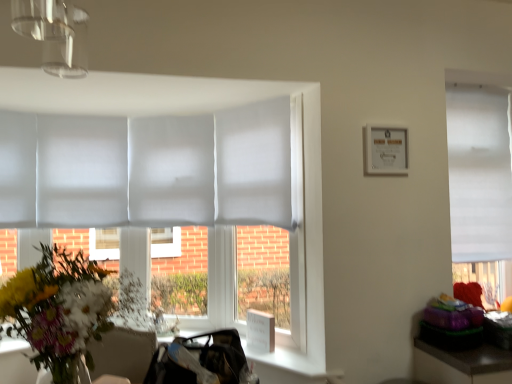
Image resolution: width=512 pixels, height=384 pixels. Describe the element at coordinates (58, 307) in the screenshot. I see `vibrant floral bouquet at left` at that location.

Where is `white matte window at right`? white matte window at right is located at coordinates (480, 180).

Find the location of a particular element. vibrant floral bouquet at left is located at coordinates (58, 307).

Can you confirm if vibrant floral bouquet at left is smaller than white paper picture frame at upper right?

Incorrect, vibrant floral bouquet at left is not smaller in size than white paper picture frame at upper right.

Which object is positioned more to the left, vibrant floral bouquet at left or white paper picture frame at upper right?

vibrant floral bouquet at left is more to the left.

Is vibrant floral bouquet at left far from white paper picture frame at upper right?

Yes, vibrant floral bouquet at left and white paper picture frame at upper right are quite far apart.

Is white paper picture frame at upper right located within vibrant floral bouquet at left?

No, white paper picture frame at upper right is not a part of vibrant floral bouquet at left.

Which of these two, white paper picture frame at upper right or white matte window at right, is bigger?

Bigger between the two is white matte window at right.

From a real-world perspective, is white paper picture frame at upper right above or below white matte window at right?

From a real-world perspective, white paper picture frame at upper right is physically above white matte window at right.

Is white paper picture frame at upper right positioned beyond the bounds of white matte window at right?

That's correct, white paper picture frame at upper right is outside of white matte window at right.

The height and width of the screenshot is (384, 512). In order to click on window that appears below the white paper picture frame at upper right (from the image's perspective) in this screenshot , I will do `click(480, 180)`.

Is white matte window at right bigger or smaller than white paper picture frame at upper right?

white matte window at right is bigger than white paper picture frame at upper right.

Does white matte window at right appear on the left side of white paper picture frame at upper right?

No.

Does white matte window at right have a greater height compared to white paper picture frame at upper right?

Yes, white matte window at right is taller than white paper picture frame at upper right.

Is white matte window at right in front of or behind white paper picture frame at upper right in the image?

Visually, white matte window at right is located behind white paper picture frame at upper right.

Consider the image. Is white paper picture frame at upper right positioned before vibrant floral bouquet at left?

No, it is not.

Considering the points (386, 169) and (48, 326), which point is behind, point (386, 169) or point (48, 326)?

Positioned behind is point (386, 169).

From the picture: From the image's perspective, relative to vibrant floral bouquet at left, is white paper picture frame at upper right above or below?

Clearly, from the image's perspective, white paper picture frame at upper right is above vibrant floral bouquet at left.

Which of these two, white paper picture frame at upper right or vibrant floral bouquet at left, is smaller?

white paper picture frame at upper right is smaller.

From the picture: Considering the sizes of white matte window at right and vibrant floral bouquet at left in the image, is white matte window at right wider or thinner than vibrant floral bouquet at left?

Clearly, white matte window at right has less width compared to vibrant floral bouquet at left.

Can vibrant floral bouquet at left be found inside white matte window at right?

Definitely not — vibrant floral bouquet at left is not inside white matte window at right.

Which is behind, white matte window at right or vibrant floral bouquet at left?

white matte window at right is further from the camera.

From the image's perspective, relative to vibrant floral bouquet at left, is white matte window at right above or below?

Clearly, from the image's perspective, white matte window at right is above vibrant floral bouquet at left.

From the picture: Does vibrant floral bouquet at left come in front of white matte window at right?

That is True.

From a real-world perspective, which is physically below, vibrant floral bouquet at left or white matte window at right?

vibrant floral bouquet at left, from a real-world perspective.

Is vibrant floral bouquet at left next to white matte window at right?

No, vibrant floral bouquet at left is not making contact with white matte window at right.

The width and height of the screenshot is (512, 384). I want to click on flower below the white matte window at right (from the image's perspective), so click(58, 307).

Find the location of a particular element. flower below the white paper picture frame at upper right (from a real-world perspective) is located at coordinates (58, 307).

Locate an element on the screen. The image size is (512, 384). picture frame that is in front of the white matte window at right is located at coordinates (386, 150).

Which object lies further to the anchor point vibrant floral bouquet at left, white matte window at right or white paper picture frame at upper right?

white matte window at right is positioned further to the anchor vibrant floral bouquet at left.

When comparing their distances from white paper picture frame at upper right, does white matte window at right or vibrant floral bouquet at left seem closer?

white matte window at right lies closer to white paper picture frame at upper right than the other object.

Considering their positions, is white paper picture frame at upper right positioned closer to vibrant floral bouquet at left than white matte window at right?

Among the two, white paper picture frame at upper right is located nearer to vibrant floral bouquet at left.

Considering their positions, is vibrant floral bouquet at left positioned further to white matte window at right than white paper picture frame at upper right?

vibrant floral bouquet at left lies further to white matte window at right than the other object.

Based on their spatial positions, is vibrant floral bouquet at left or white matte window at right closer to white paper picture frame at upper right?

white matte window at right lies closer to white paper picture frame at upper right than the other object.

When comparing their distances from white matte window at right, does white paper picture frame at upper right or vibrant floral bouquet at left seem closer?

The object closer to white matte window at right is white paper picture frame at upper right.

The image size is (512, 384). What are the coordinates of `picture frame between vibrant floral bouquet at left and white matte window at right in the horizontal direction` in the screenshot? It's located at (386, 150).